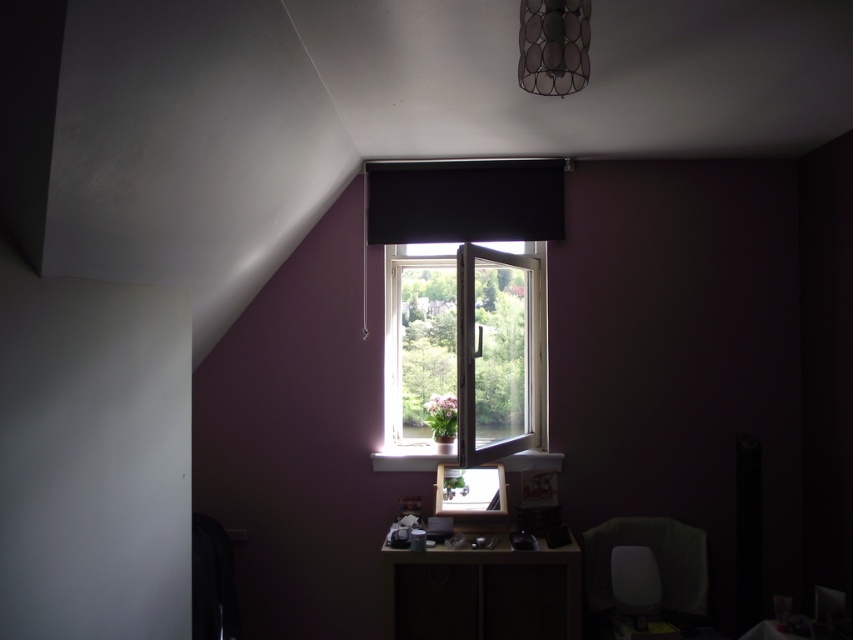
Question: Which is nearer to the metallic wire mesh lampshade at upper center?

Choices:
 (A) velvet green chair at lower right
 (B) wooden at center
 (C) white plastic window at center

Answer: (C)

Question: Can you confirm if white plastic window at center is thinner than wooden at center?

Choices:
 (A) no
 (B) yes

Answer: (A)

Question: Can you confirm if black matte curtain at upper center is thinner than wooden at center?

Choices:
 (A) no
 (B) yes

Answer: (A)

Question: Is metallic wire mesh lampshade at upper center above wooden at center?

Choices:
 (A) yes
 (B) no

Answer: (A)

Question: Considering the real-world distances, which object is closest to the wooden at center?

Choices:
 (A) velvet green chair at lower right
 (B) metallic wire mesh lampshade at upper center
 (C) black matte curtain at upper center

Answer: (A)

Question: Which point is closer to the camera?

Choices:
 (A) metallic wire mesh lampshade at upper center
 (B) wooden at center
 (C) velvet green chair at lower right

Answer: (A)